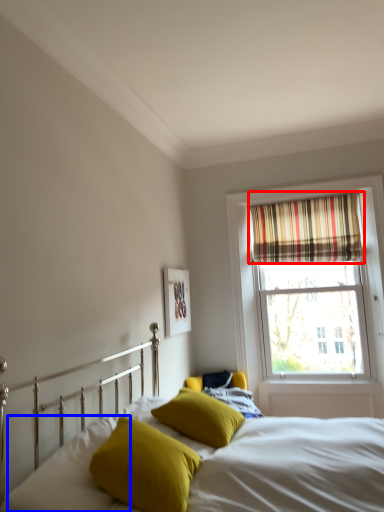
Question: Which point is closer to the camera, curtain (highlighted by a red box) or pillow (highlighted by a blue box)?

Choices:
 (A) curtain
 (B) pillow

Answer: (B)